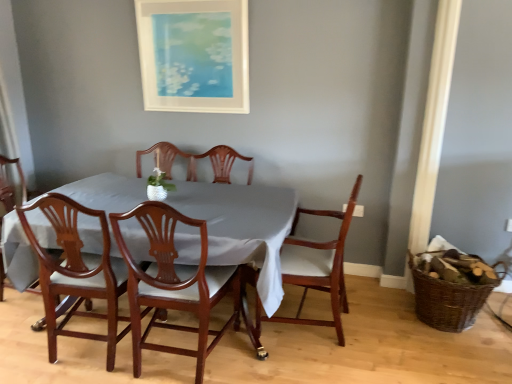
Question: Should I look upward or downward to see brown woven basket at right?

Choices:
 (A) up
 (B) down

Answer: (B)

Question: Considering the relative positions of matte white picture frame at upper center and brown woven basket at right in the image provided, is matte white picture frame at upper center to the right of brown woven basket at right from the viewer's perspective?

Choices:
 (A) yes
 (B) no

Answer: (B)

Question: Does matte white picture frame at upper center have a greater height compared to brown woven basket at right?

Choices:
 (A) yes
 (B) no

Answer: (A)

Question: Is brown woven basket at right located within matte white picture frame at upper center?

Choices:
 (A) yes
 (B) no

Answer: (B)

Question: Is matte white picture frame at upper center bigger than brown woven basket at right?

Choices:
 (A) yes
 (B) no

Answer: (B)

Question: Is matte white picture frame at upper center smaller than brown woven basket at right?

Choices:
 (A) no
 (B) yes

Answer: (B)

Question: Can we say matte white picture frame at upper center lies outside brown woven basket at right?

Choices:
 (A) no
 (B) yes

Answer: (B)

Question: Is mahogany wood chair at lower left, the 2th chair viewed from the left, wider than matte white picture frame at upper center?

Choices:
 (A) no
 (B) yes

Answer: (B)

Question: Can matte white picture frame at upper center be found inside mahogany wood chair at lower left, positioned as the 3th chair in right-to-left order?

Choices:
 (A) no
 (B) yes

Answer: (A)

Question: Considering the relative sizes of mahogany wood chair at lower left, the 2th chair viewed from the left, and matte white picture frame at upper center in the image provided, is mahogany wood chair at lower left, the 2th chair viewed from the left, taller than matte white picture frame at upper center?

Choices:
 (A) yes
 (B) no

Answer: (A)

Question: From the image's perspective, is mahogany wood chair at lower left, the 2th chair viewed from the left, located beneath matte white picture frame at upper center?

Choices:
 (A) no
 (B) yes

Answer: (B)

Question: Does mahogany wood chair at lower left, the 2th chair viewed from the left, come in front of matte white picture frame at upper center?

Choices:
 (A) yes
 (B) no

Answer: (A)

Question: Is mahogany wood chair at lower left, positioned as the 3th chair in right-to-left order, smaller than matte white picture frame at upper center?

Choices:
 (A) no
 (B) yes

Answer: (A)

Question: Can you confirm if mahogany table at center is shorter than mahogany wood chair at lower left, positioned as the 3th chair in right-to-left order?

Choices:
 (A) yes
 (B) no

Answer: (A)